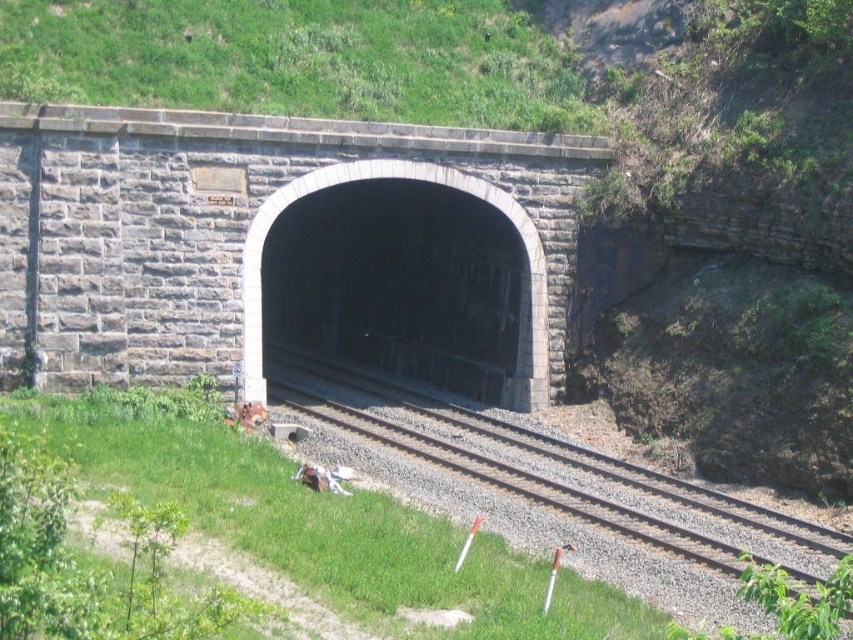
Based on the photo, can you confirm if gravel railroad tracks at center is bigger than dark gray stone tunnel at center?

Yes, gravel railroad tracks at center is bigger than dark gray stone tunnel at center.

Can you confirm if gravel railroad tracks at center is positioned to the left of dark gray stone tunnel at center?

No, gravel railroad tracks at center is not to the left of dark gray stone tunnel at center.

What do you see at coordinates (534, 461) in the screenshot?
I see `gravel railroad tracks at center` at bounding box center [534, 461].

Where is `gravel railroad tracks at center`? This screenshot has width=853, height=640. gravel railroad tracks at center is located at coordinates (x=534, y=461).